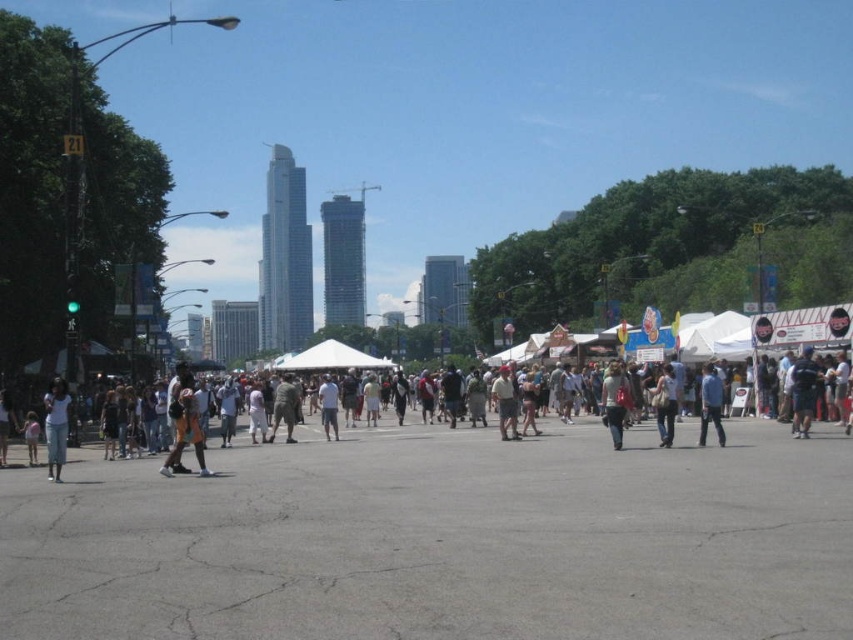
Question: Is light gray cotton shirt at center thinner than light brown fabric bag at center?

Choices:
 (A) yes
 (B) no

Answer: (B)

Question: Estimate the real-world distances between objects in this image. Which object is closer to the light brown leather jacket at center?

Choices:
 (A) blue denim jeans at center
 (B) light gray cotton shirt at center

Answer: (B)

Question: Observing the image, what is the correct spatial positioning of blue denim jeans at center in reference to light brown leather jacket at center?

Choices:
 (A) below
 (B) above

Answer: (B)

Question: Can you confirm if blue denim jeans at center is positioned to the left of white cotton shirt at center?

Choices:
 (A) no
 (B) yes

Answer: (A)

Question: Which point is farther to the camera?

Choices:
 (A) click(x=666, y=410)
 (B) click(x=721, y=396)
 (C) click(x=503, y=410)

Answer: (C)

Question: Among these objects, which one is farthest from the camera?

Choices:
 (A) dark blue jeans at center
 (B) white matte shirt at lower left

Answer: (A)